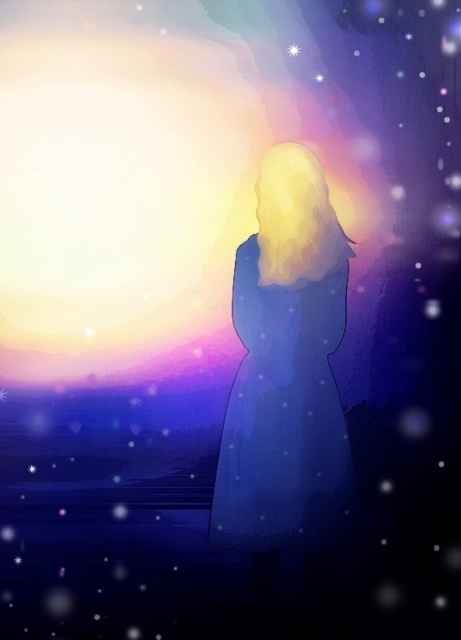
You are an astronaut on a spacewalk and see the matte blue dress at center and the bright white star at upper center. Which object is wider?

The matte blue dress at center is wider than the bright white star at upper center according to the description.

You are an astronomer observing the scene. You notice the matte blue dress at center and the bright white star at upper center. Which object is located lower in the image?

The matte blue dress at center is positioned under the bright white star at upper center, so the dress is lower than the star.